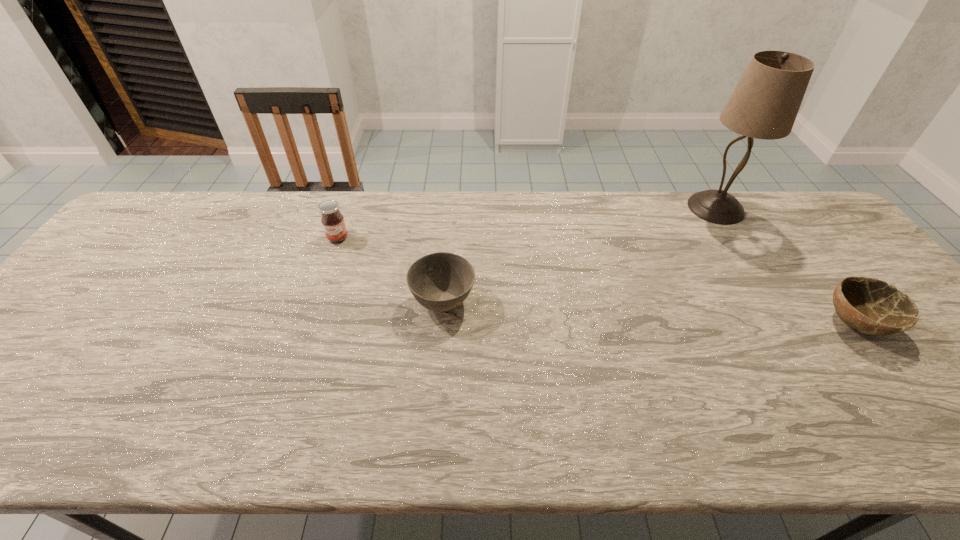
Image resolution: width=960 pixels, height=540 pixels. What are the coordinates of `free location located on the front of the left bowl` in the screenshot? It's located at (434, 427).

Locate an element on the screen. The height and width of the screenshot is (540, 960). free space located 0.160m on the left of the right bowl is located at coordinates (760, 323).

Image resolution: width=960 pixels, height=540 pixels. What are the coordinates of `lampshade that is at the far edge` in the screenshot? It's located at (764, 105).

Find the location of a particular element. jam located at the far edge is located at coordinates (332, 220).

Image resolution: width=960 pixels, height=540 pixels. Identify the location of object that is at the right edge. (871, 306).

Find the location of a particular element. Image resolution: width=960 pixels, height=540 pixels. vacant point at the far edge is located at coordinates (571, 228).

Image resolution: width=960 pixels, height=540 pixels. What are the coordinates of `vacant area at the near edge of the desktop` in the screenshot? It's located at (531, 442).

This screenshot has height=540, width=960. Identify the location of vacant space at the right edge. (799, 239).

In the image, there is a desktop. Identify the location of vacant space at the far left corner. (168, 217).

Locate an element on the screen. This screenshot has width=960, height=540. free region at the far right corner of the desktop is located at coordinates (824, 222).